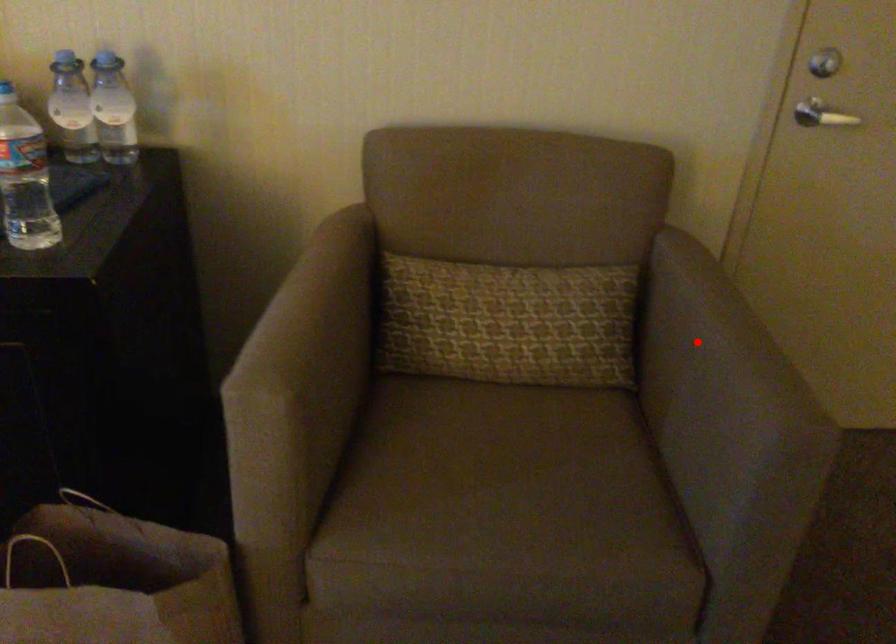
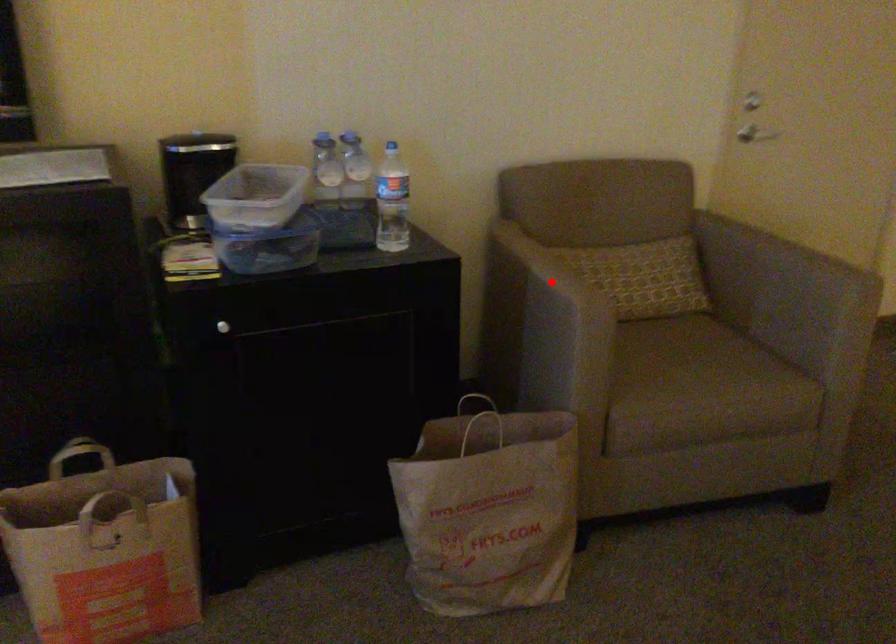
I am providing you with two images of the same scene from different viewpoints. A red point is marked on the first image and another point is marked on the second image. Is the marked point in image1 the same physical position as the marked point in image2?

No